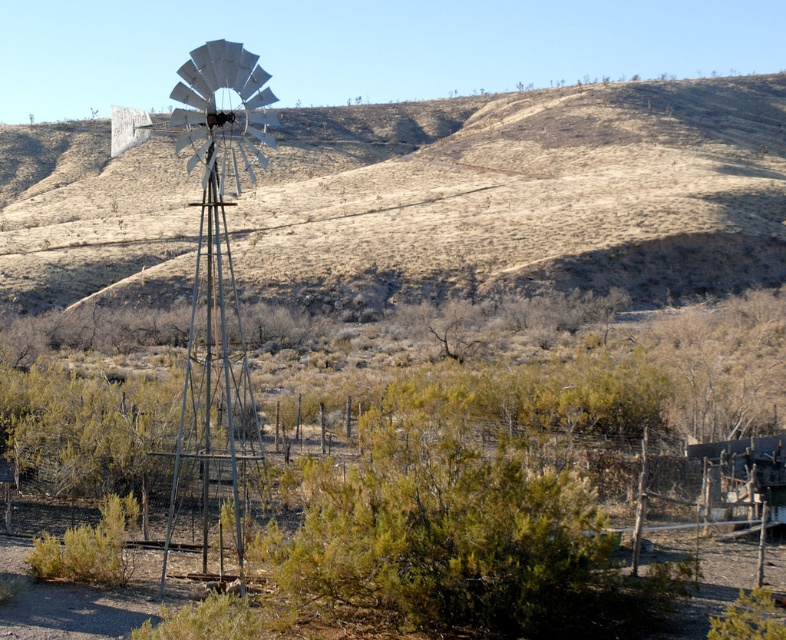
Question: From the image, what is the correct spatial relationship of brown grassy hillside at center in relation to metallic windmill at center-left?

Choices:
 (A) below
 (B) above

Answer: (B)

Question: Does brown grassy hillside at center appear over metallic windmill at center-left?

Choices:
 (A) no
 (B) yes

Answer: (B)

Question: Which point is farther to the camera?

Choices:
 (A) brown grassy hillside at center
 (B) metallic windmill at center-left

Answer: (A)

Question: Can you confirm if brown grassy hillside at center is thinner than metallic windmill at center-left?

Choices:
 (A) no
 (B) yes

Answer: (A)